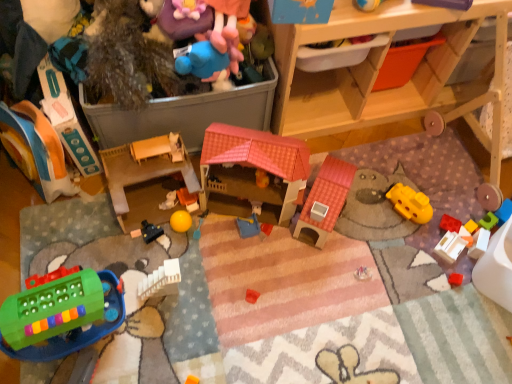
Identify the location of empty space that is in between smooth plastic toy at center, the ninth toy viewed from the right, and blue plastic toy at center, which is the fifth toy from right to left. This screenshot has height=384, width=512. (217, 221).